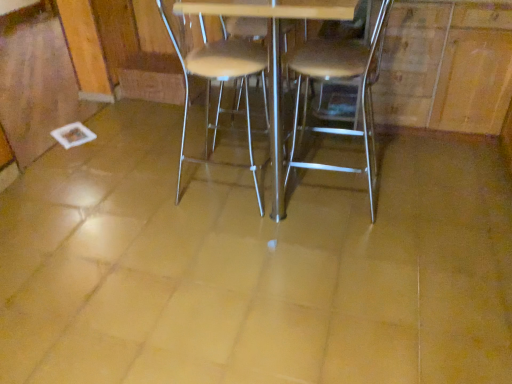
Identify the location of vacant space behind metallic silver chair at center, which appears as the first chair when viewed from the left. The image size is (512, 384). (233, 148).